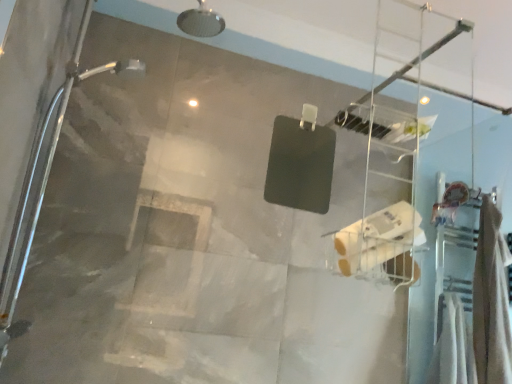
What is the approximate height of white matte toilet paper at center?

white matte toilet paper at center is 6.72 inches in height.

You are a GUI agent. You are given a task and a screenshot of the screen. Output one action in this format:
    pyautogui.click(x=<x>, y=<y>)
    Task: Click on the clear plastic ladder at upper center
    This screenshot has width=512, height=384.
    Given the screenshot: What is the action you would take?
    pyautogui.click(x=399, y=139)

Does beige fabric towel at right have a smaller size compared to clear plastic ladder at upper center?

Actually, beige fabric towel at right might be larger than clear plastic ladder at upper center.

Between beige fabric towel at right and clear plastic ladder at upper center, which one has smaller width?

clear plastic ladder at upper center.

Is point (504, 357) closer or farther from the camera than point (369, 138)?

Clearly, point (504, 357) is more distant from the camera than point (369, 138).

Between beige fabric towel at right and clear plastic ladder at upper center, which one is positioned behind?

beige fabric towel at right is further away from the camera.

Image resolution: width=512 pixels, height=384 pixels. I want to click on toilet paper located in front of the clear plastic ladder at upper center, so click(x=378, y=238).

From a real-world perspective, which is physically above, white matte toilet paper at center or clear plastic ladder at upper center?

clear plastic ladder at upper center is physically above.

Measure the distance between white matte toilet paper at center and clear plastic ladder at upper center.

1.07 meters.

Considering the sizes of objects white matte toilet paper at center and clear plastic ladder at upper center in the image provided, who is thinner, white matte toilet paper at center or clear plastic ladder at upper center?

Thinner between the two is white matte toilet paper at center.

Which object is thinner, clear plastic ladder at upper center or white matte toilet paper at center?

With smaller width is white matte toilet paper at center.

How many degrees apart are the facing directions of clear plastic ladder at upper center and white matte toilet paper at center?

The angle between the facing direction of clear plastic ladder at upper center and the facing direction of white matte toilet paper at center is 1.08 degrees.

Is clear plastic ladder at upper center not near white matte toilet paper at center?

clear plastic ladder at upper center is positioned a significant distance from white matte toilet paper at center.

In order to click on ladder behind the white matte toilet paper at center in this screenshot , I will do `click(399, 139)`.

You are a GUI agent. You are given a task and a screenshot of the screen. Output one action in this format:
    pyautogui.click(x=<x>, y=<y>)
    Task: Click on the shower curtain on the right of the white matte toilet paper at center
    This screenshot has width=512, height=384.
    Given the screenshot: What is the action you would take?
    pyautogui.click(x=490, y=300)

From the image's perspective, relative to white matte toilet paper at center, is beige fabric towel at right above or below?

Based on their image positions, beige fabric towel at right is located beneath white matte toilet paper at center.

From their relative heights in the image, would you say beige fabric towel at right is taller or shorter than white matte toilet paper at center?

Considering their sizes, beige fabric towel at right has more height than white matte toilet paper at center.

Is clear plastic ladder at upper center facing away from beige fabric towel at right?

No.

Does clear plastic ladder at upper center have a smaller size compared to beige fabric towel at right?

Yes, clear plastic ladder at upper center is smaller than beige fabric towel at right.

Is clear plastic ladder at upper center further to camera compared to beige fabric towel at right?

No, the depth of clear plastic ladder at upper center is less than that of beige fabric towel at right.

Is clear plastic ladder at upper center thinner than beige fabric towel at right?

Yes.

Is white matte toilet paper at center looking in the opposite direction of beige fabric towel at right?

No.

Identify the location of shower curtain that is behind the white matte toilet paper at center. (490, 300).

In terms of size, does white matte toilet paper at center appear bigger or smaller than beige fabric towel at right?

Considering their sizes, white matte toilet paper at center takes up less space than beige fabric towel at right.

How far apart are white matte toilet paper at center and beige fabric towel at right?

white matte toilet paper at center and beige fabric towel at right are 77.08 centimeters apart from each other.

Where is `ladder that appears on the left of beige fabric towel at right`? The image size is (512, 384). ladder that appears on the left of beige fabric towel at right is located at coordinates (399, 139).

Find the location of a particular element. The image size is (512, 384). toilet paper that appears in front of the clear plastic ladder at upper center is located at coordinates (378, 238).

When comparing their distances from beige fabric towel at right, does white matte toilet paper at center or clear plastic ladder at upper center seem closer?

clear plastic ladder at upper center is positioned closer to the anchor beige fabric towel at right.

Estimate the real-world distances between objects in this image. Which object is further from white matte toilet paper at center, clear plastic ladder at upper center or beige fabric towel at right?

clear plastic ladder at upper center is further to white matte toilet paper at center.

Consider the image. Which object lies further to the anchor point clear plastic ladder at upper center, beige fabric towel at right or white matte toilet paper at center?

white matte toilet paper at center.

Estimate the real-world distances between objects in this image. Which object is closer to beige fabric towel at right, clear plastic ladder at upper center or white matte toilet paper at center?

Based on the image, clear plastic ladder at upper center appears to be nearer to beige fabric towel at right.

Considering their positions, is beige fabric towel at right positioned closer to white matte toilet paper at center than clear plastic ladder at upper center?

beige fabric towel at right lies closer to white matte toilet paper at center than the other object.

Looking at the image, which one is located closer to clear plastic ladder at upper center, white matte toilet paper at center or beige fabric towel at right?

beige fabric towel at right is closer to clear plastic ladder at upper center.

Image resolution: width=512 pixels, height=384 pixels. I want to click on ladder between white matte toilet paper at center and beige fabric towel at right from left to right, so click(399, 139).